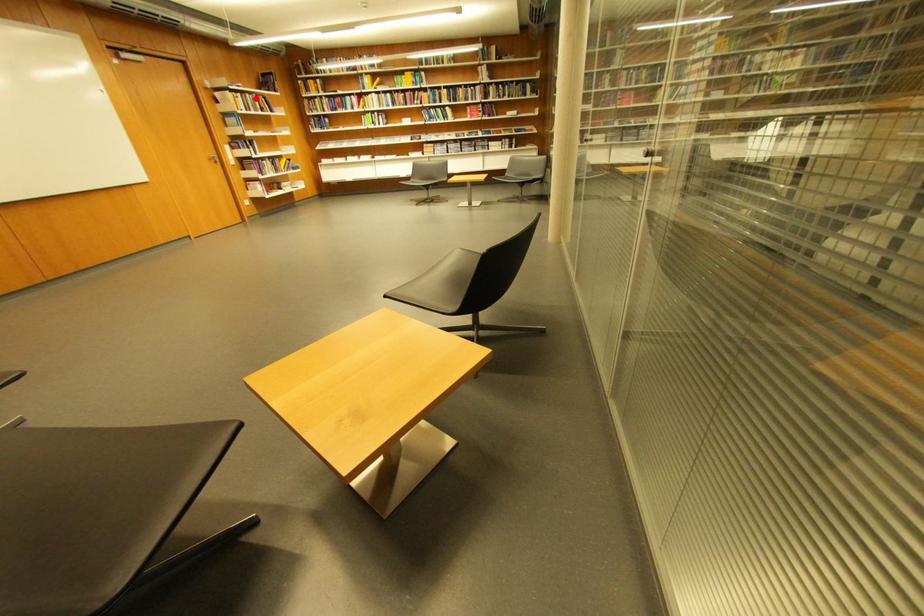
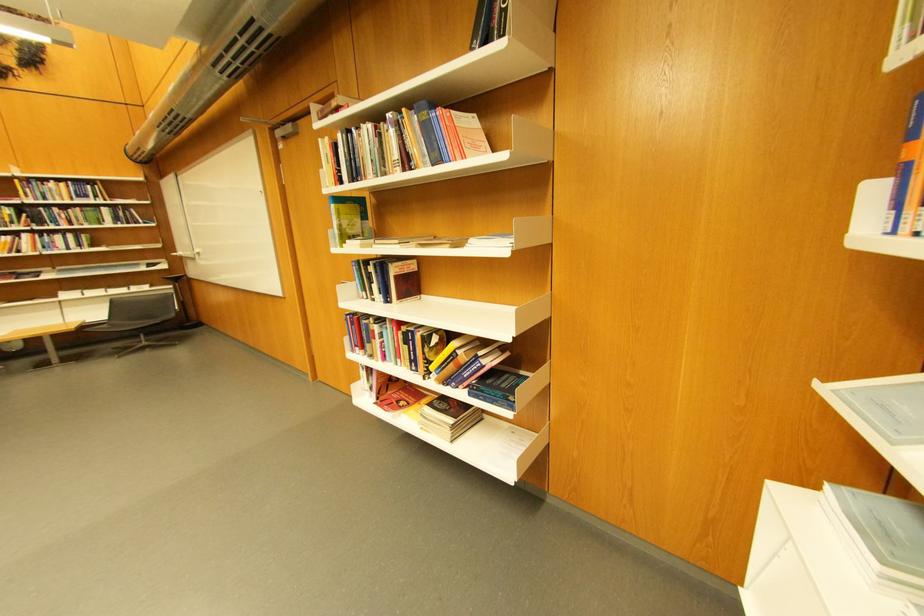
Question: I am providing you with two images of the same scene from different viewpoints. A red point is marked on the first image. Is the red point's position out of view in image 2?

Choices:
 (A) Yes
 (B) No

Answer: (B)